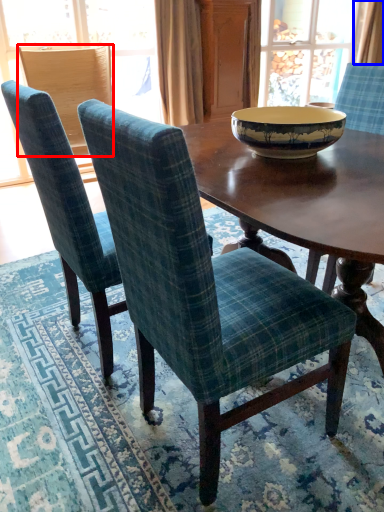
Question: Among these objects, which one is farthest to the camera, chair (highlighted by a red box) or curtain (highlighted by a blue box)?

Choices:
 (A) chair
 (B) curtain

Answer: (B)